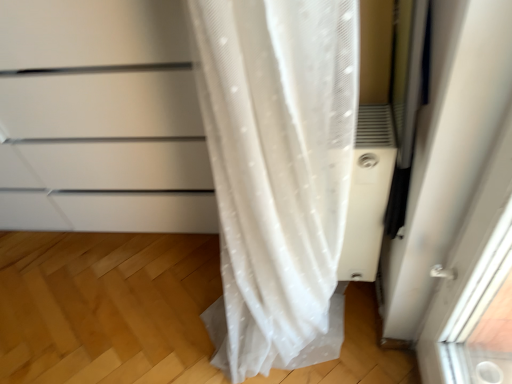
Question: Is white plastic air conditioner at right facing towards white matte cabinet at left?

Choices:
 (A) no
 (B) yes

Answer: (A)

Question: Is the position of white plastic air conditioner at right more distant than that of white matte cabinet at left?

Choices:
 (A) yes
 (B) no

Answer: (A)

Question: Considering the relative sizes of white plastic air conditioner at right and white matte cabinet at left in the image provided, is white plastic air conditioner at right smaller than white matte cabinet at left?

Choices:
 (A) no
 (B) yes

Answer: (B)

Question: Is white plastic air conditioner at right outside white matte cabinet at left?

Choices:
 (A) no
 (B) yes

Answer: (B)

Question: From the image's perspective, is white plastic air conditioner at right beneath white matte cabinet at left?

Choices:
 (A) yes
 (B) no

Answer: (A)

Question: Is the surface of white plastic air conditioner at right in direct contact with white matte cabinet at left?

Choices:
 (A) yes
 (B) no

Answer: (B)

Question: Is white matte cabinet at left directly adjacent to white plastic air conditioner at right?

Choices:
 (A) no
 (B) yes

Answer: (A)

Question: Is white matte cabinet at left bigger than white plastic air conditioner at right?

Choices:
 (A) no
 (B) yes

Answer: (B)

Question: Can you confirm if white matte cabinet at left is positioned to the right of white plastic air conditioner at right?

Choices:
 (A) yes
 (B) no

Answer: (B)

Question: From the image's perspective, is white matte cabinet at left located beneath white plastic air conditioner at right?

Choices:
 (A) yes
 (B) no

Answer: (B)

Question: Does white matte cabinet at left have a smaller size compared to white plastic air conditioner at right?

Choices:
 (A) yes
 (B) no

Answer: (B)

Question: Does white matte cabinet at left lie behind white plastic air conditioner at right?

Choices:
 (A) yes
 (B) no

Answer: (B)

Question: Is white plastic air conditioner at right situated inside white matte cabinet at left or outside?

Choices:
 (A) inside
 (B) outside

Answer: (B)